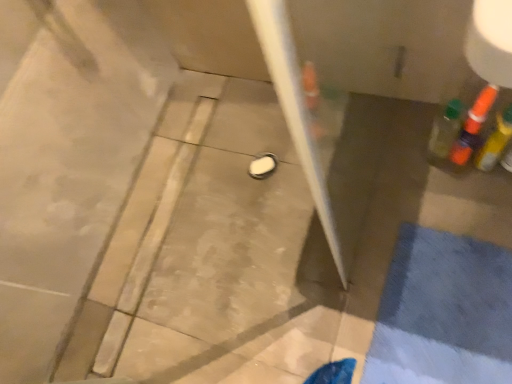
This screenshot has width=512, height=384. What are the coordinates of `vacant position to the left of translucent orange bottle at upper right, placed as the 2th bottle when sorted from left to right` in the screenshot? It's located at (417, 184).